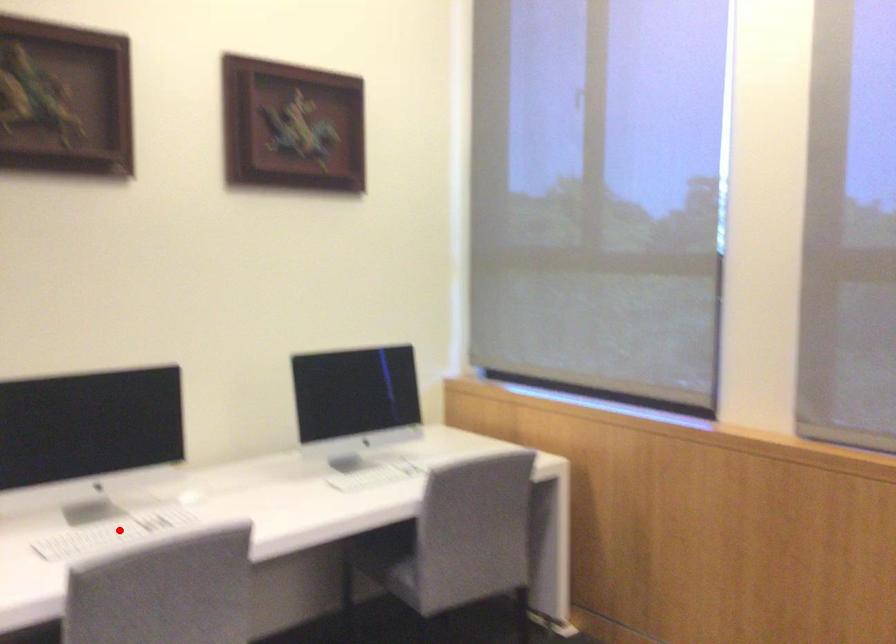
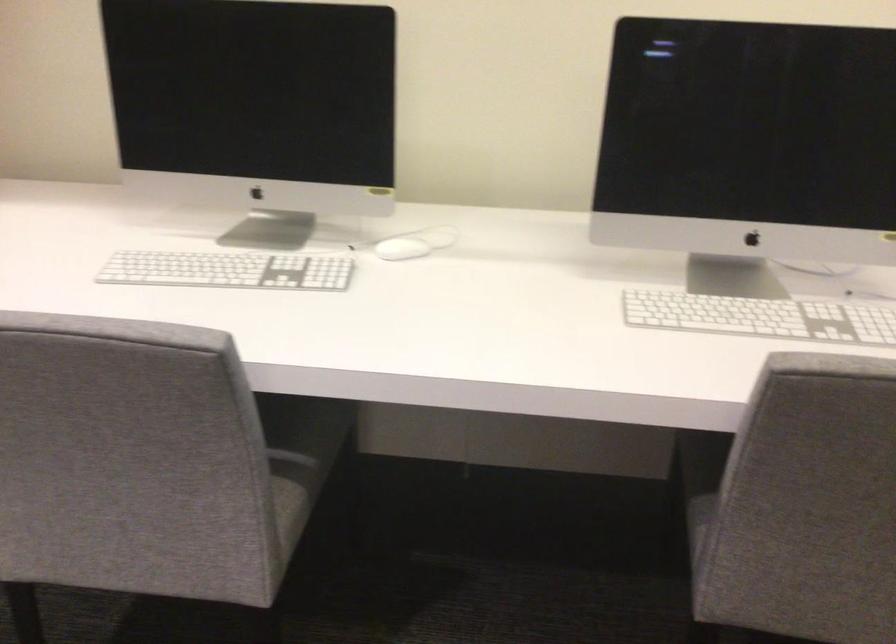
Where in the second image is the point corresponding to the highlighted location from the first image?

(228, 270)